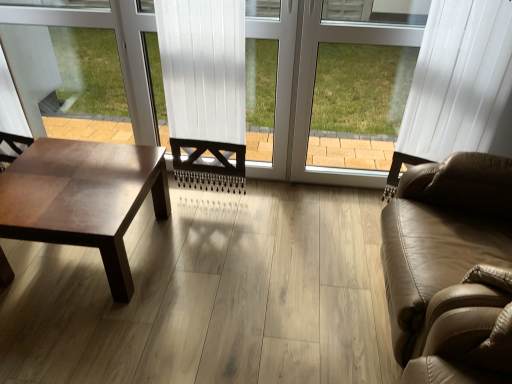
Locate an element on the screen. This screenshot has width=512, height=384. vacant area to the right of shiny brown wood coffee table at left is located at coordinates (218, 263).